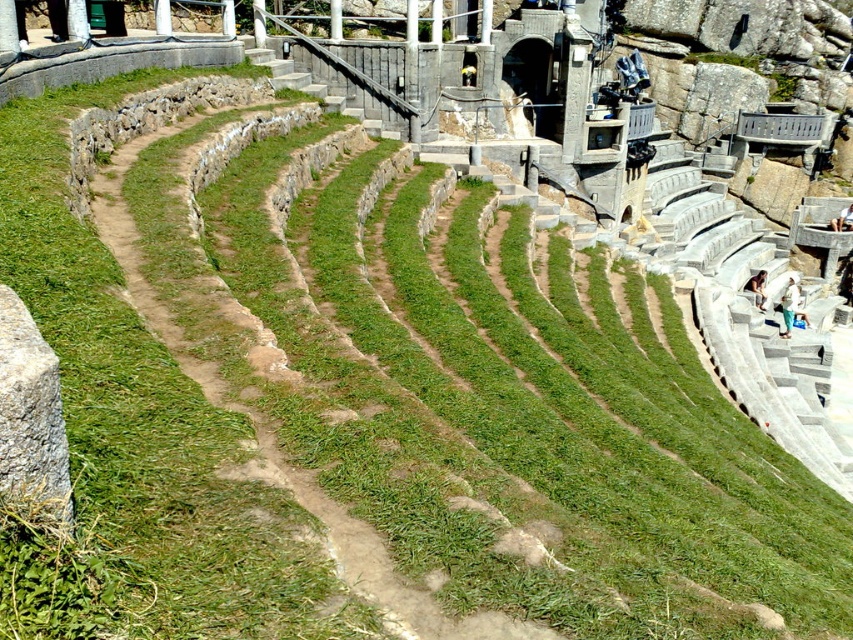
Question: Can you confirm if white cotton shirt at lower right is wider than light brown stone person at lower right?

Choices:
 (A) no
 (B) yes

Answer: (B)

Question: Is gray rough stone at lower left thinner than white cotton shirt at lower right?

Choices:
 (A) no
 (B) yes

Answer: (B)

Question: Which object is closer to the camera taking this photo?

Choices:
 (A) white cotton shirt at lower right
 (B) gray rough stone at lower left
 (C) light brown stone person at lower right

Answer: (B)

Question: Among these points, which one is farthest from the camera?

Choices:
 (A) (26, 435)
 (B) (762, 269)

Answer: (B)

Question: Which point is closer to the camera?

Choices:
 (A) gray rough stone at lower left
 (B) white cotton shirt at lower right

Answer: (A)

Question: Does gray rough stone at lower left come in front of light brown stone person at lower right?

Choices:
 (A) yes
 (B) no

Answer: (A)